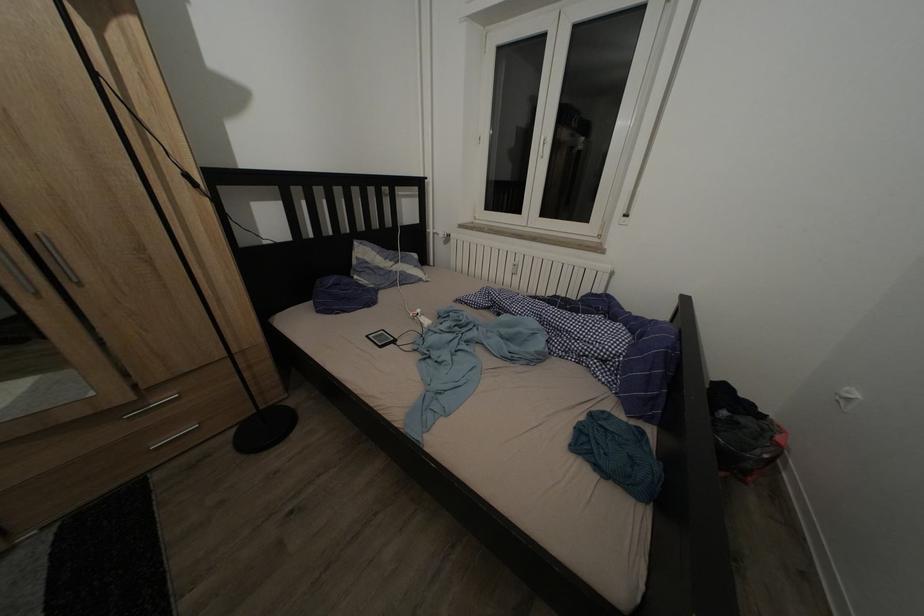
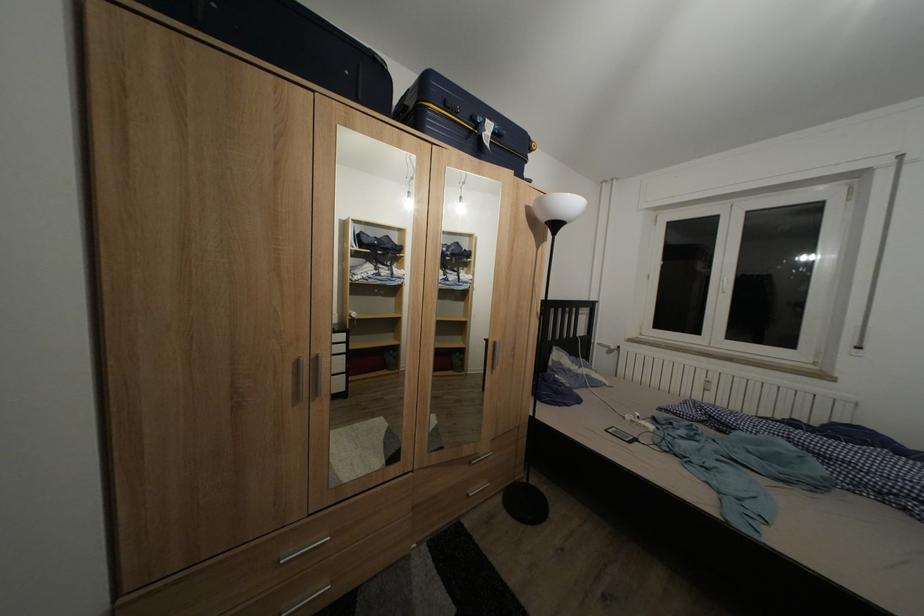
In a continuous first-person perspective shot, in which direction is the camera moving?

The cameraman moved toward left, backward.